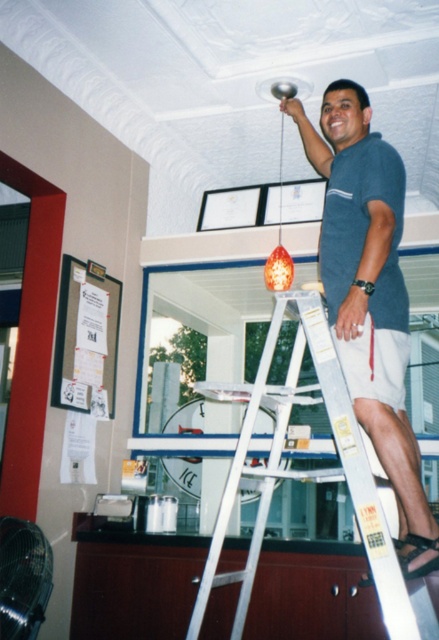
Question: Is white metallic ladder at center to the left of orange glass pendant at upper center from the viewer's perspective?

Choices:
 (A) yes
 (B) no

Answer: (A)

Question: Is blue cotton shirt at upper center further to the viewer compared to orange glass pendant at upper center?

Choices:
 (A) yes
 (B) no

Answer: (B)

Question: Among these objects, which one is farthest from the camera?

Choices:
 (A) blue cotton shirt at upper center
 (B) orange glass pendant at upper center

Answer: (B)

Question: Which point is farther to the camera?

Choices:
 (A) white metallic ladder at center
 (B) blue cotton shirt at upper center

Answer: (B)

Question: Considering the relative positions of blue cotton shirt at upper center and orange glass pendant at upper center in the image provided, where is blue cotton shirt at upper center located with respect to orange glass pendant at upper center?

Choices:
 (A) below
 (B) above

Answer: (A)

Question: Which object is farther from the camera taking this photo?

Choices:
 (A) blue cotton shirt at upper center
 (B) orange glass pendant at upper center
 (C) white metallic ladder at center

Answer: (B)